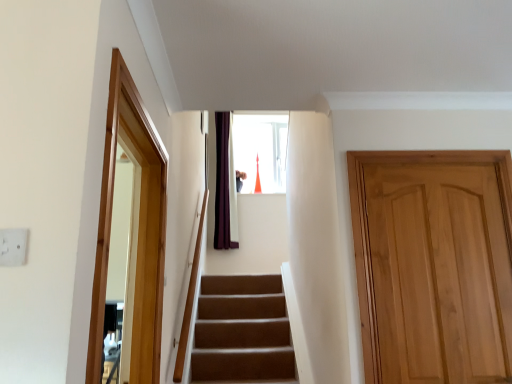
Question: In the image, is wooden frame at left positioned in front of or behind light brown wood door at right?

Choices:
 (A) behind
 (B) front

Answer: (B)

Question: In terms of height, does wooden frame at left look taller or shorter compared to light brown wood door at right?

Choices:
 (A) tall
 (B) short

Answer: (B)

Question: Is wooden frame at left spatially inside light brown wood door at right, or outside of it?

Choices:
 (A) inside
 (B) outside

Answer: (B)

Question: From their relative heights in the image, would you say light brown wood door at right is taller or shorter than wooden frame at left?

Choices:
 (A) short
 (B) tall

Answer: (B)

Question: Is point (509, 223) closer or farther from the camera than point (112, 177)?

Choices:
 (A) closer
 (B) farther

Answer: (B)

Question: Looking at their shapes, would you say light brown wood door at right is wider or thinner than wooden frame at left?

Choices:
 (A) thin
 (B) wide

Answer: (A)

Question: Considering the relative positions of light brown wood door at right and wooden frame at left in the image provided, is light brown wood door at right to the left or to the right of wooden frame at left?

Choices:
 (A) left
 (B) right

Answer: (B)